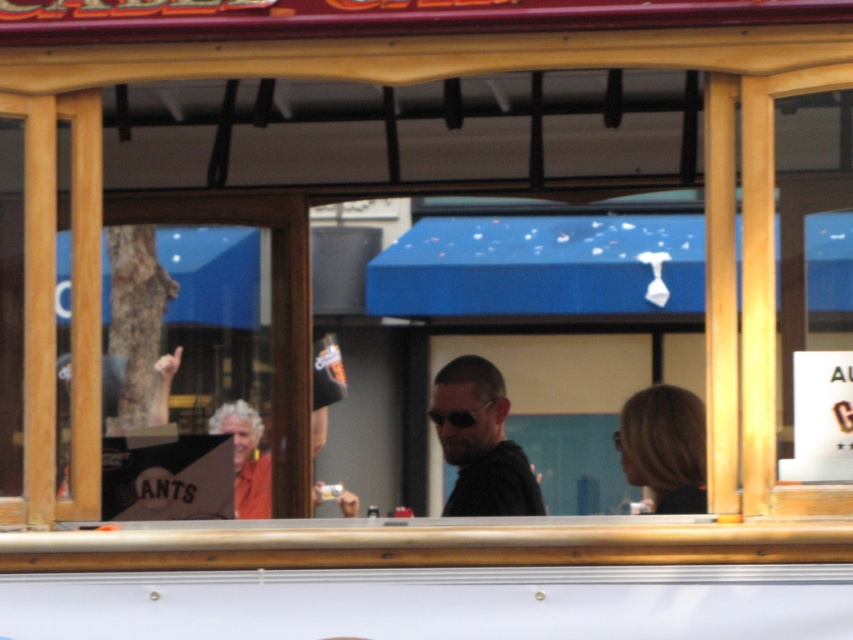
You are a passenger on the tram and want to know if the person with blonde hair at center is taller than the sunglasses at center. Can you confirm this?

The blonde hair at center is taller than sunglasses at center, so yes, the person with blonde hair at center is taller than the sunglasses at center.